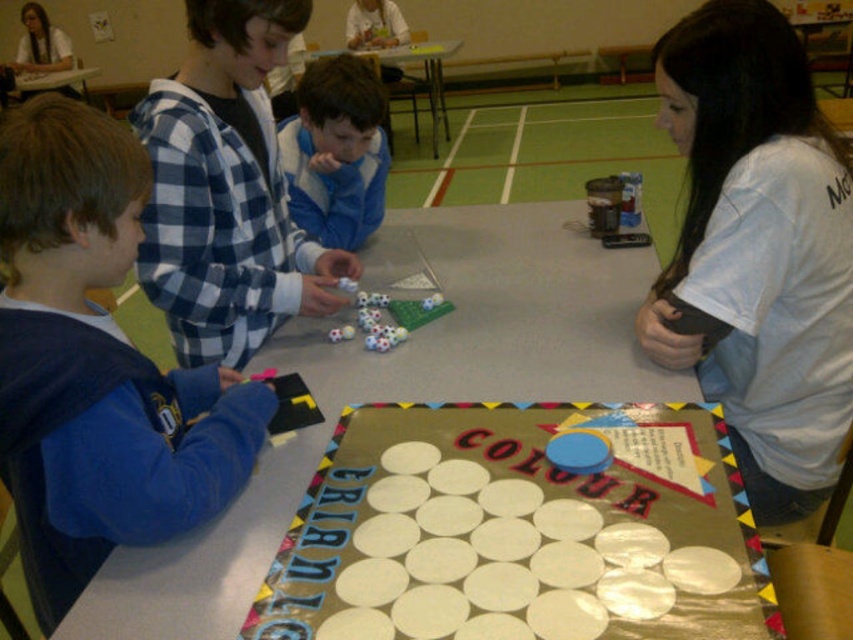
Does blue fleece jacket at center have a lesser height compared to smooth plastic table at center?

Correct, blue fleece jacket at center is not as tall as smooth plastic table at center.

Does point (314, 237) come behind point (410, 100)?

No, it is in front of (410, 100).

This screenshot has width=853, height=640. In order to click on blue fleece jacket at center in this screenshot , I will do `click(335, 150)`.

The width and height of the screenshot is (853, 640). Identify the location of blue fleece jacket at center. click(x=335, y=150).

From the picture: Who is more distant from viewer, [373,612] or [200,445]?

Point [200,445]

Does point (769, 620) come closer to viewer compared to point (125, 384)?

Yes, it is in front of point (125, 384).

I want to click on white plastic circles at center, so click(519, 531).

Who is lower down, rubber soccer balls at center or smooth plastic table at center?

rubber soccer balls at center is lower down.

Is rubber soccer balls at center to the left of smooth plastic table at center from the viewer's perspective?

Incorrect, rubber soccer balls at center is not on the left side of smooth plastic table at center.

Which is behind, point (410, 307) or point (378, 54)?

Point (378, 54)

What are the coordinates of `rubber soccer balls at center` in the screenshot? It's located at (390, 316).